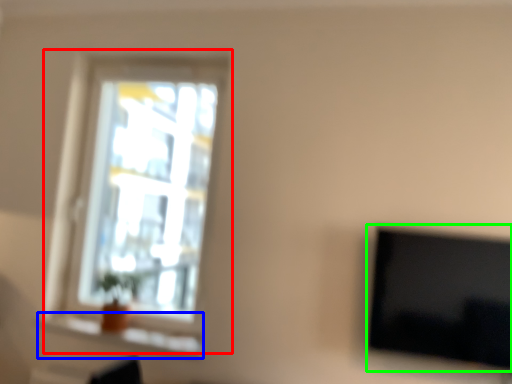
Question: Which object is the closest to the window (highlighted by a red box)? Choose among these: window sill (highlighted by a blue box) or television (highlighted by a green box).

Choices:
 (A) window sill
 (B) television

Answer: (A)